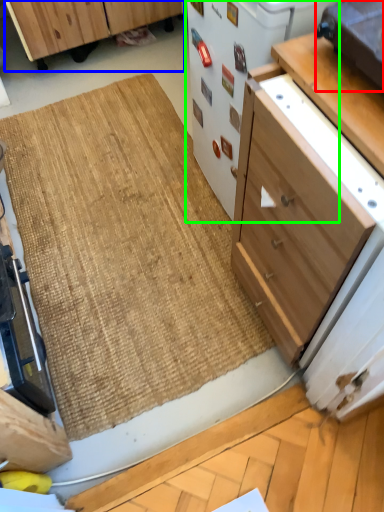
Question: Based on their relative distances, which object is farther from appliance (highlighted by a red box)? Choose from cabinetry (highlighted by a blue box) and appliance (highlighted by a green box).

Choices:
 (A) cabinetry
 (B) appliance

Answer: (A)